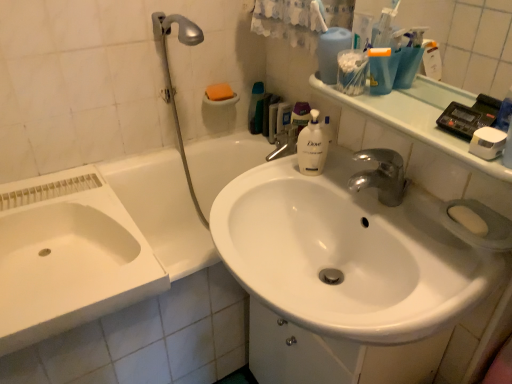
Question: Is clear plastic container at upper right not near orange sponge at upper center, the 1th soap positioned from the top?

Choices:
 (A) yes
 (B) no

Answer: (B)

Question: From the image's perspective, is clear plastic container at upper right under orange sponge at upper center, which ranks as the second soap in bottom-to-top order?

Choices:
 (A) no
 (B) yes

Answer: (B)

Question: Considering the relative positions of clear plastic container at upper right and orange sponge at upper center, the first soap positioned from the back, in the image provided, is clear plastic container at upper right to the left of orange sponge at upper center, the first soap positioned from the back, from the viewer's perspective?

Choices:
 (A) yes
 (B) no

Answer: (B)

Question: Is clear plastic container at upper right taller than orange sponge at upper center, the first soap positioned from the left?

Choices:
 (A) no
 (B) yes

Answer: (B)

Question: Considering the relative sizes of clear plastic container at upper right and orange sponge at upper center, the second soap from the front, in the image provided, is clear plastic container at upper right thinner than orange sponge at upper center, the second soap from the front,?

Choices:
 (A) no
 (B) yes

Answer: (B)

Question: Choose the correct answer: Is orange sponge at upper center, which is the second soap from right to left, inside white glossy sink at upper right or outside it?

Choices:
 (A) inside
 (B) outside

Answer: (B)

Question: Is orange sponge at upper center, which is the second soap from right to left, taller or shorter than white glossy sink at upper right?

Choices:
 (A) short
 (B) tall

Answer: (A)

Question: In terms of size, does orange sponge at upper center, which ranks as the second soap in bottom-to-top order, appear bigger or smaller than white glossy sink at upper right?

Choices:
 (A) small
 (B) big

Answer: (A)

Question: In terms of width, does orange sponge at upper center, the first soap positioned from the left, look wider or thinner when compared to white glossy sink at upper right?

Choices:
 (A) wide
 (B) thin

Answer: (B)

Question: From a real-world perspective, is white fabric bath towel at upper center physically located above or below white glossy sink at upper right?

Choices:
 (A) above
 (B) below

Answer: (A)

Question: Which is correct: white fabric bath towel at upper center is inside white glossy sink at upper right, or outside of it?

Choices:
 (A) outside
 (B) inside

Answer: (A)

Question: Is white fabric bath towel at upper center bigger or smaller than white glossy sink at upper right?

Choices:
 (A) big
 (B) small

Answer: (A)

Question: Does point (301, 3) appear closer or farther from the camera than point (373, 104)?

Choices:
 (A) farther
 (B) closer

Answer: (A)

Question: Looking at the image, does orange sponge at upper center, the first soap positioned from the left, seem bigger or smaller compared to yellow matte soap at right, which is the second soap from top to bottom?

Choices:
 (A) small
 (B) big

Answer: (B)

Question: Choose the correct answer: Is orange sponge at upper center, the first soap positioned from the back, inside yellow matte soap at right, which is counted as the 1th soap, starting from the front, or outside it?

Choices:
 (A) outside
 (B) inside

Answer: (A)